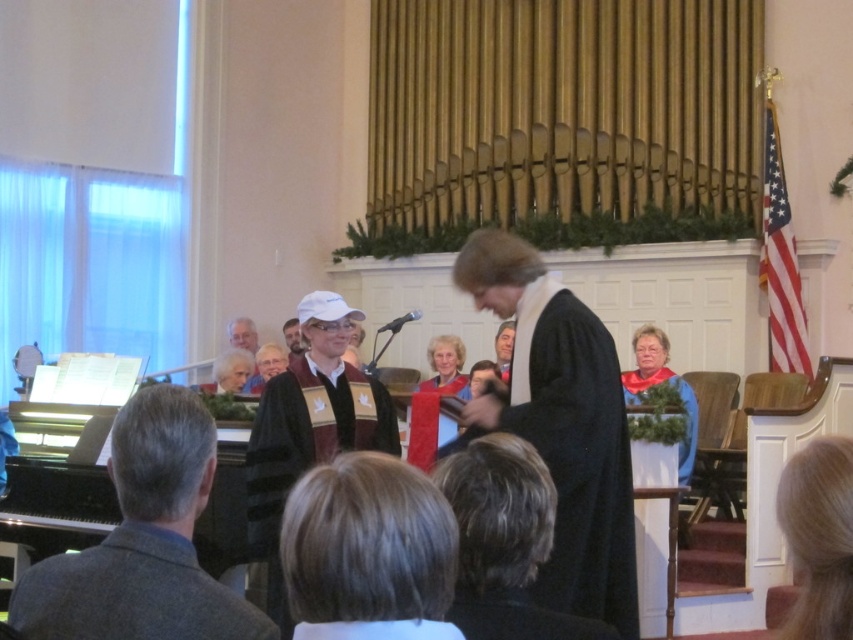
Question: Estimate the real-world distances between objects in this image. Which object is closer to the matte brown robe at center?

Choices:
 (A) gray wool coat at lower left
 (B) matte red scarf at center
 (C) smooth brown robe at center
 (D) blonde hair at lower right

Answer: (C)

Question: Can you confirm if gray wool coat at lower left is smaller than maroon velvet stole at center?

Choices:
 (A) no
 (B) yes

Answer: (B)

Question: Can you confirm if black matte robe at center is smaller than matte brown robe at center?

Choices:
 (A) yes
 (B) no

Answer: (B)

Question: Does blonde hair at center appear on the right side of maroon velvet stole at center?

Choices:
 (A) no
 (B) yes

Answer: (B)

Question: Among these objects, which one is farthest from the camera?

Choices:
 (A) matte red scarf at center
 (B) smooth brown robe at center
 (C) blonde hair at lower right
 (D) maroon velvet stole at center

Answer: (B)

Question: Which of the following is the farthest from the observer?

Choices:
 (A) gray wool robe at lower left
 (B) gray wool coat at lower left
 (C) matte red scarf at center
 (D) blonde hair at center

Answer: (C)